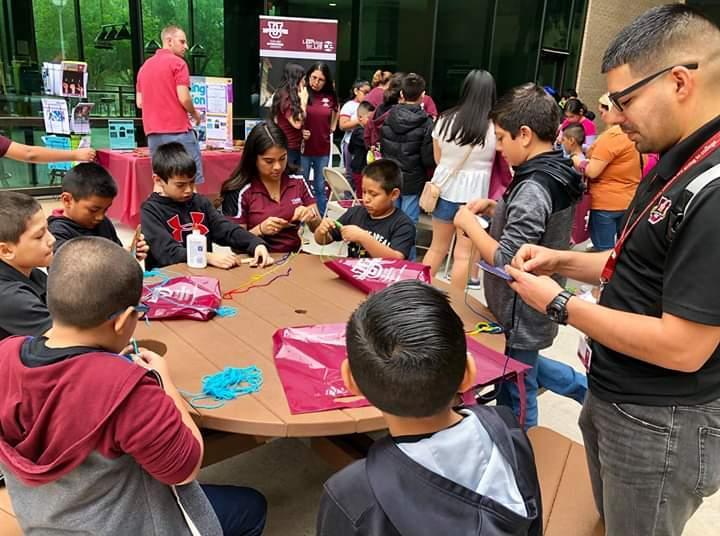
Locate an element on the screen. This screenshot has height=536, width=720. table is located at coordinates (289, 306), (130, 173).